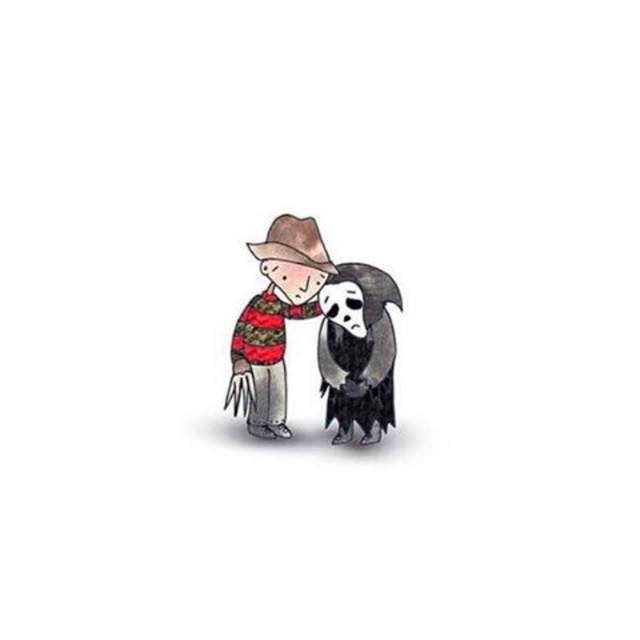
Looking at this image, you are standing in the scene and want to move from the point at coordinates point (237, 403) to the point at coordinates point (369, 436). Which direction should you move to get closer to your destination?

To move from point (237, 403) to point (369, 436), you should move upwards and to the right since point (237, 403) is in front of point (369, 436), indicating it is closer to the viewer. Moving towards the destination would require going away from the viewer, which would involve moving upwards and to the right in the image plane.

You are an artist trying to draw the scene described. You want to place a black matte ghost at lower right exactly at point 0.548, 0.559 in 2D coordinates. However, you accidentally placed it at point 0.55, 0.56. How far off is your placement in terms of coordinates?

The coordinates of the black matte ghost at lower right were intended to be at (356, 349) but were placed at (358, 352). The difference in the x coordinate is 0.002 and the difference in the y coordinate is 0.001. So the placement is off by 0.002 in x and 0.001 in y.

In the scene shown: You are standing in front of the image and see the point at coordinates [323,253]. If you want to touch this point with a 1 meter long stick, can you reach it?

The point at coordinates [323,253] is 5.92 meters away from the camera, so using a 1 meter long stick would not be sufficient to reach it.